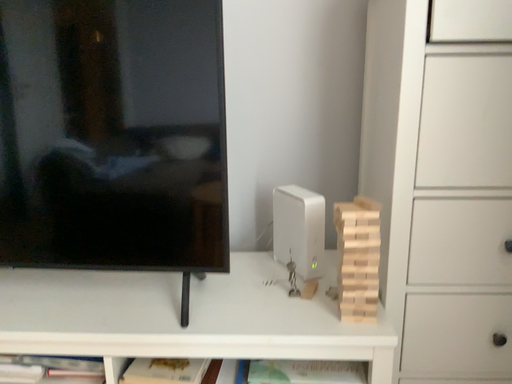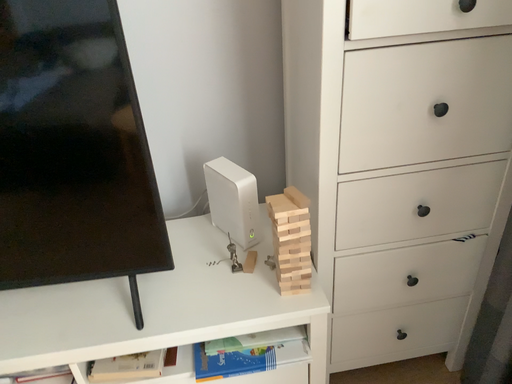
Question: Which way did the camera rotate in the video?

Choices:
 (A) rotated upward
 (B) rotated downward

Answer: (B)